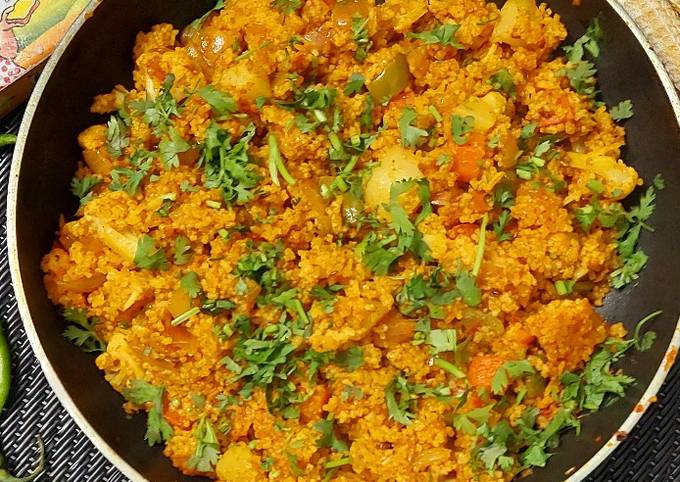
Image resolution: width=680 pixels, height=482 pixels. Identify the location of silverware would go to the left of bowl. (3, 248).